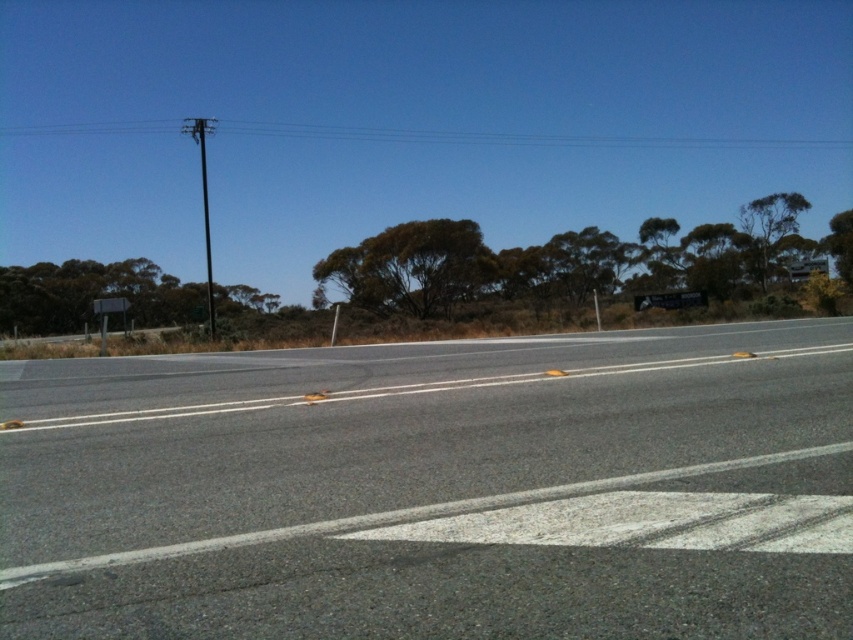
Is point (581, 582) closer to camera compared to point (637, 305)?

Yes, point (581, 582) is in front of point (637, 305).

The image size is (853, 640). Identify the location of gray asphalt road at center. (437, 490).